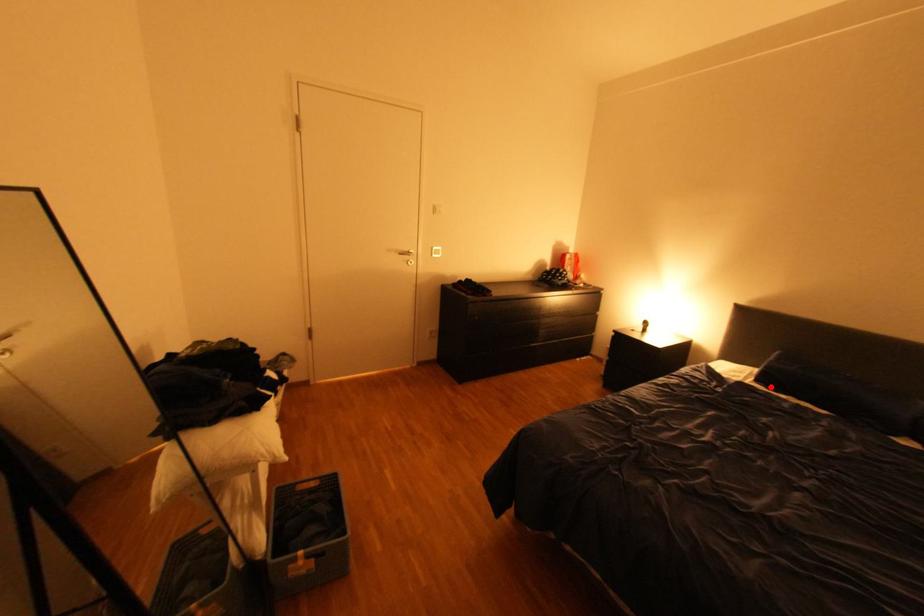
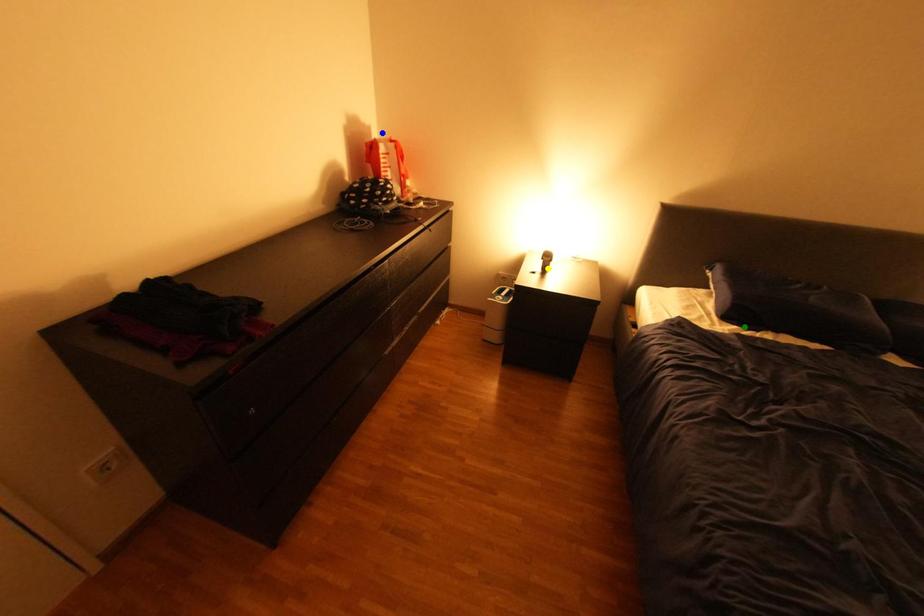
Question: I am providing you with two images of the same scene from different viewpoints. A red point is marked on the first image. You are given multiple points on the second image. Which point in image 2 is actually the same real-world point as the red point in image 1?

Choices:
 (A) blue point
 (B) yellow point
 (C) green point

Answer: (C)